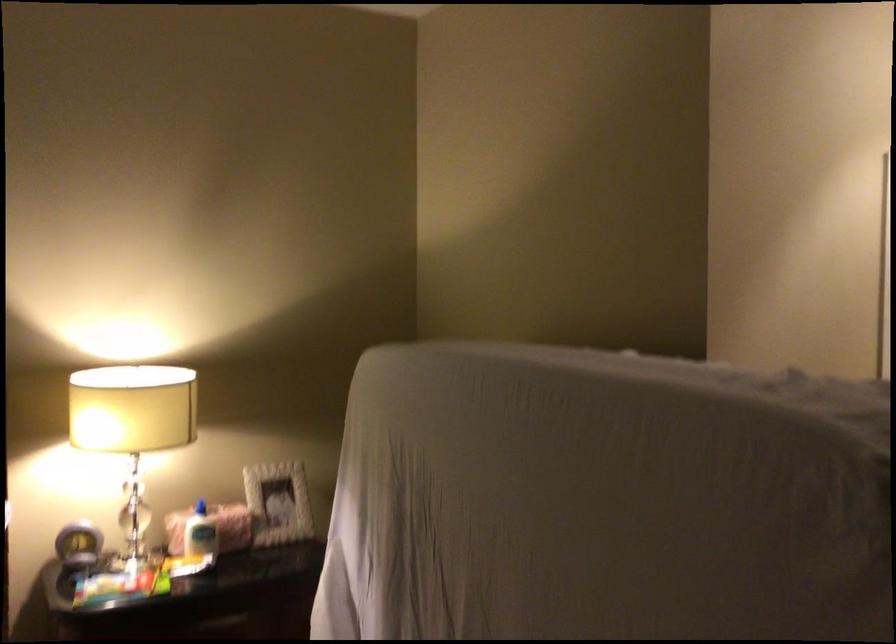
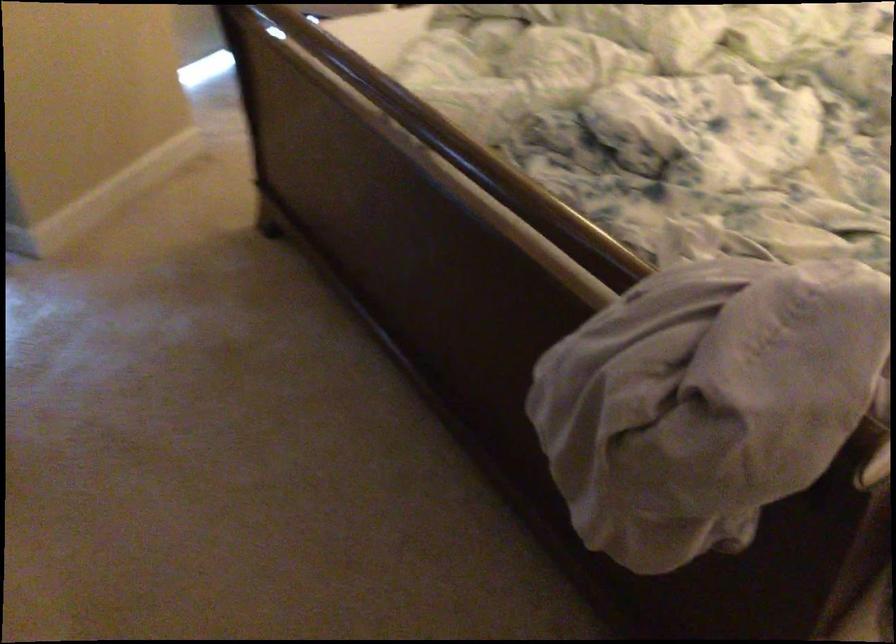
The images are taken continuously from a first-person perspective. In which direction is your viewpoint rotating?

The camera rotated toward left-down.